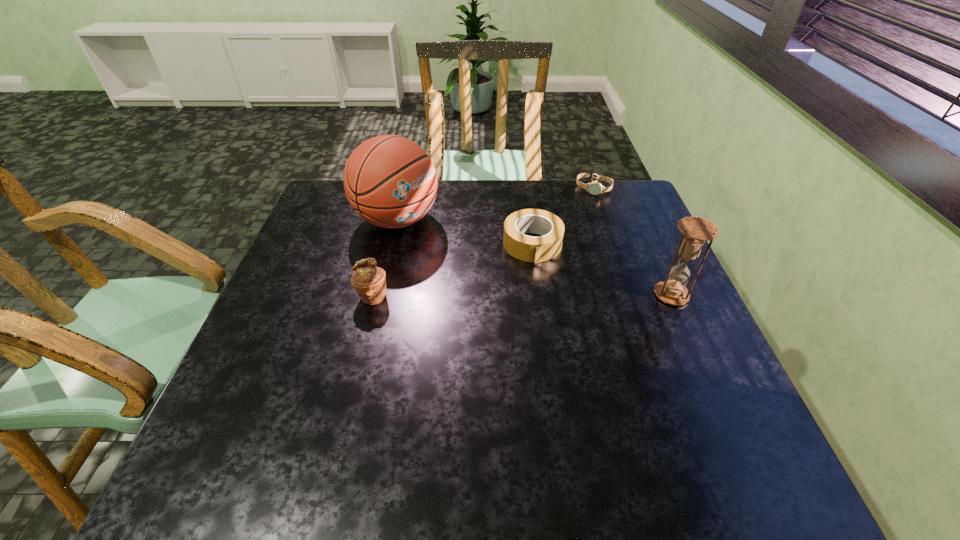
I want to click on muffin, so click(x=369, y=281).

You are a GUI agent. You are given a task and a screenshot of the screen. Output one action in this format:
    pyautogui.click(x=<x>, y=<y>)
    Task: Click on the hourglass
    The width and height of the screenshot is (960, 540).
    Given the screenshot: What is the action you would take?
    pyautogui.click(x=695, y=231)

Identify the location of basketball. (390, 181).

You are a GUI agent. You are given a task and a screenshot of the screen. Output one action in this format:
    pyautogui.click(x=<x>, y=<y>)
    Task: Click on the shortest object
    The image size is (960, 540).
    Given the screenshot: What is the action you would take?
    pyautogui.click(x=595, y=188)

The image size is (960, 540). What are the coordinates of `the third object from left to right` in the screenshot? It's located at (526, 248).

Locate an element on the screen. Image resolution: width=960 pixels, height=540 pixels. the fourth tallest object is located at coordinates (526, 248).

Find the location of a particular element. Image resolution: width=960 pixels, height=540 pixels. vacant space situated on the front of the muffin is located at coordinates (357, 360).

You are a GUI agent. You are given a task and a screenshot of the screen. Output one action in this format:
    pyautogui.click(x=<x>, y=<y>)
    Task: Click on the free space located 0.280m on the left of the hourglass
    
    Given the screenshot: What is the action you would take?
    pyautogui.click(x=541, y=295)

This screenshot has width=960, height=540. Find the location of `vacant region located 0.350m on the logo side of the tallest object`. vacant region located 0.350m on the logo side of the tallest object is located at coordinates (534, 285).

Identify the location of vacant space located on the logo side of the tallest object. This screenshot has width=960, height=540. (498, 268).